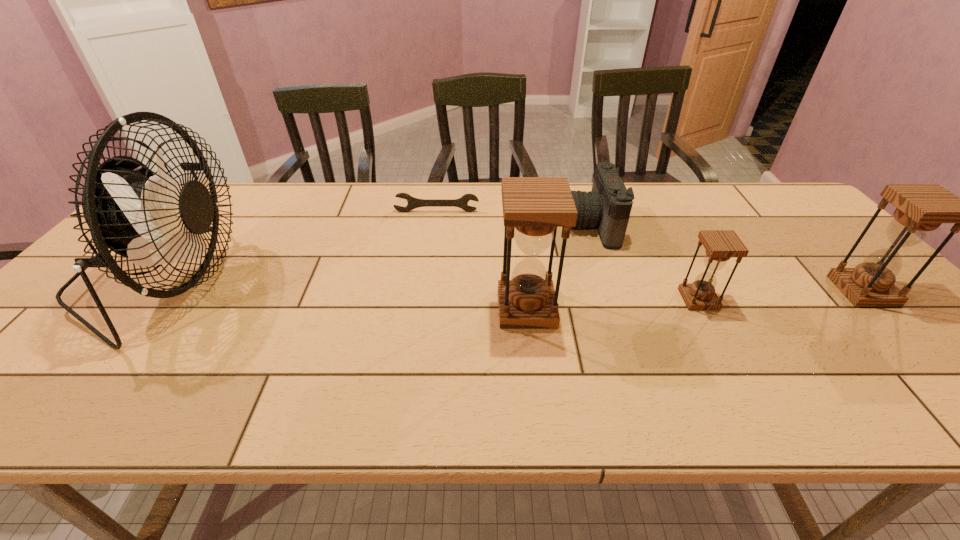
You are a GUI agent. You are given a task and a screenshot of the screen. Output one action in this format:
    pyautogui.click(x=<x>, y=<y>)
    Task: Click on the object that is at the near edge
    This screenshot has width=960, height=540.
    Given the screenshot: What is the action you would take?
    pyautogui.click(x=148, y=218)

Find the location of a particular element. The image size is (960, 540). object present at the left edge is located at coordinates (148, 218).

Where is `object that is at the right edge`? This screenshot has width=960, height=540. object that is at the right edge is located at coordinates (920, 208).

You are a GUI agent. You are given a task and a screenshot of the screen. Output one action in this format:
    pyautogui.click(x=<x>, y=<y>)
    Task: Click on the object present at the near left corner
    This screenshot has width=960, height=540.
    Given the screenshot: What is the action you would take?
    pyautogui.click(x=148, y=218)

At what (x,y) coordinates should I click in order to perform the action: click on vacant space at the far edge of the desktop. Please return your answer as a coordinate pair (x, y). This screenshot has width=960, height=540. Looking at the image, I should click on (427, 221).

The width and height of the screenshot is (960, 540). What are the coordinates of `vacant region at the near edge of the desktop` in the screenshot? It's located at (885, 372).

Where is `vacant area at the right edge`? vacant area at the right edge is located at coordinates coord(789,241).

Where is `free space between the second tallest hourglass and the shortest hourglass`? The image size is (960, 540). free space between the second tallest hourglass and the shortest hourglass is located at coordinates (780, 295).

Locate an element on the screen. unoccupied area between the second object from left to right and the third object from left to right is located at coordinates click(482, 260).

This screenshot has width=960, height=540. I want to click on object that can be found as the second closest to the leftmost object, so click(x=533, y=207).